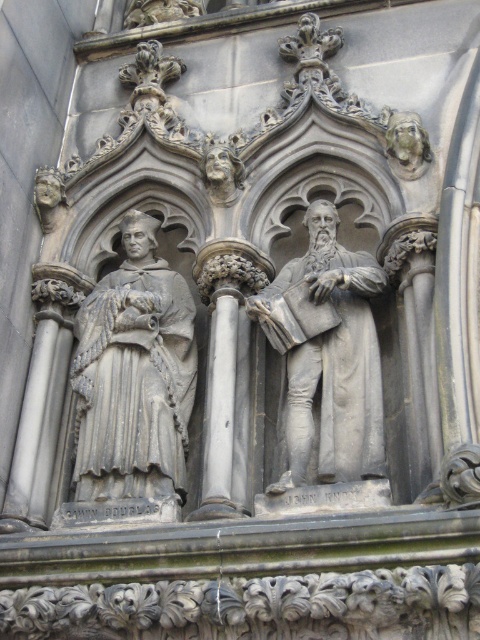
Question: Where is gray stone statue at left located in relation to gray stone column at center in the image?

Choices:
 (A) above
 (B) below

Answer: (A)

Question: Which object is positioned farthest from the gray stone statue at left?

Choices:
 (A) gray stone statue at center
 (B) gray stone column at center
 (C) gray stone pillar at left

Answer: (A)

Question: Considering the real-world distances, which object is closest to the gray stone pillar at left?

Choices:
 (A) gray stone column at center
 (B) gray stone statue at center
 (C) gray stone statue at left

Answer: (C)

Question: Which object is positioned closest to the gray stone statue at center?

Choices:
 (A) gray stone statue at left
 (B) gray stone pillar at left
 (C) gray stone column at center

Answer: (C)

Question: Where is gray stone statue at left located in relation to gray stone pillar at left in the image?

Choices:
 (A) right
 (B) left

Answer: (A)

Question: Does gray stone statue at left appear under gray stone statue at center?

Choices:
 (A) no
 (B) yes

Answer: (B)